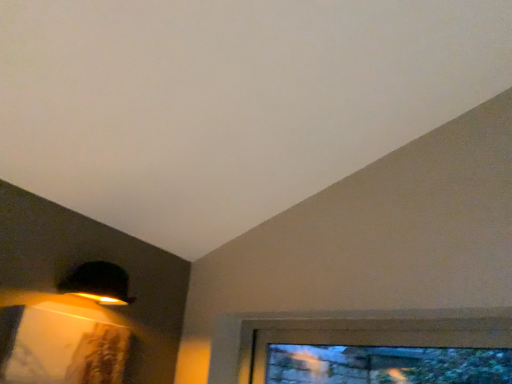
Question: Would you say clear glass window at lower right is to the left or to the right of matte black lampshade at upper left in the picture?

Choices:
 (A) right
 (B) left

Answer: (A)

Question: Is clear glass window at lower right situated inside matte black lampshade at upper left or outside?

Choices:
 (A) outside
 (B) inside

Answer: (A)

Question: Looking at their shapes, would you say clear glass window at lower right is wider or thinner than matte black lampshade at upper left?

Choices:
 (A) thin
 (B) wide

Answer: (A)

Question: From the image's perspective, relative to clear glass window at lower right, is matte black lampshade at upper left above or below?

Choices:
 (A) above
 (B) below

Answer: (A)

Question: Considering the relative positions of matte black lampshade at upper left and clear glass window at lower right in the image provided, is matte black lampshade at upper left to the left or to the right of clear glass window at lower right?

Choices:
 (A) left
 (B) right

Answer: (A)

Question: Is matte black lampshade at upper left taller or shorter than clear glass window at lower right?

Choices:
 (A) tall
 (B) short

Answer: (B)

Question: From a real-world perspective, is matte black lampshade at upper left positioned above or below clear glass window at lower right?

Choices:
 (A) above
 (B) below

Answer: (A)